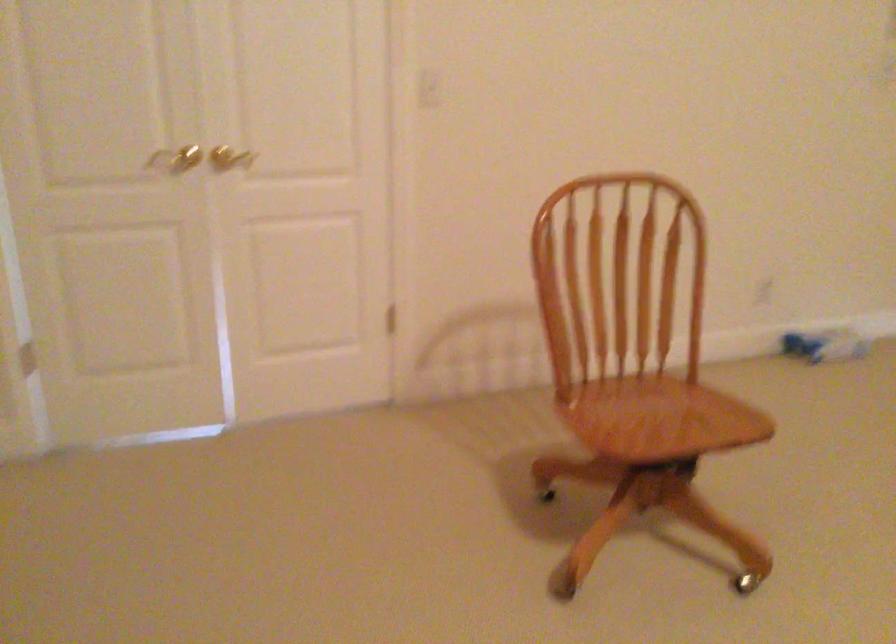
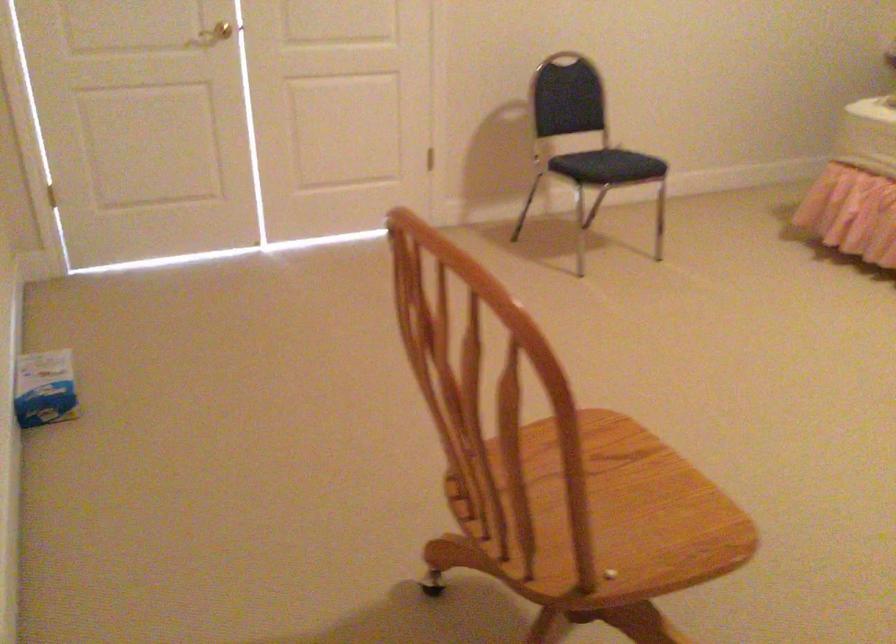
Where in the second image is the point corresponding to pixel 640 435 from the first image?

(613, 509)